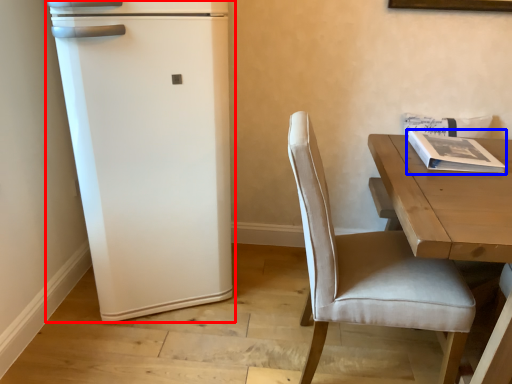
Question: Which of the following is the farthest to the observer, refrigerator (highlighted by a red box) or magazine (highlighted by a blue box)?

Choices:
 (A) refrigerator
 (B) magazine

Answer: (B)